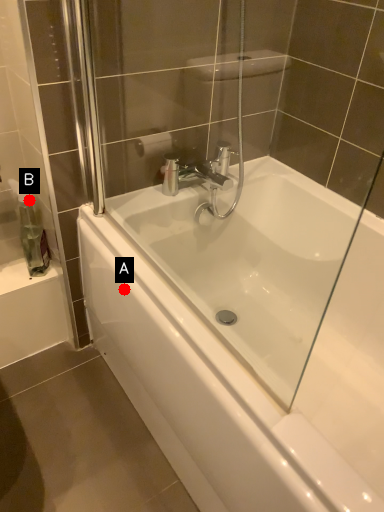
Question: Two points are circled on the image, labeled by A and B beside each circle. Which point appears farthest from the camera in this image?

Choices:
 (A) A is further
 (B) B is further

Answer: (B)